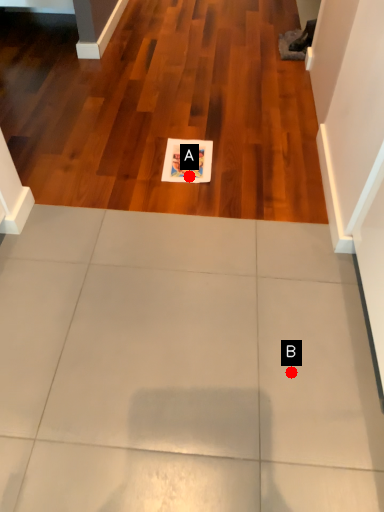
Question: Two points are circled on the image, labeled by A and B beside each circle. Among these points, which one is nearest to the camera?

Choices:
 (A) A is closer
 (B) B is closer

Answer: (B)